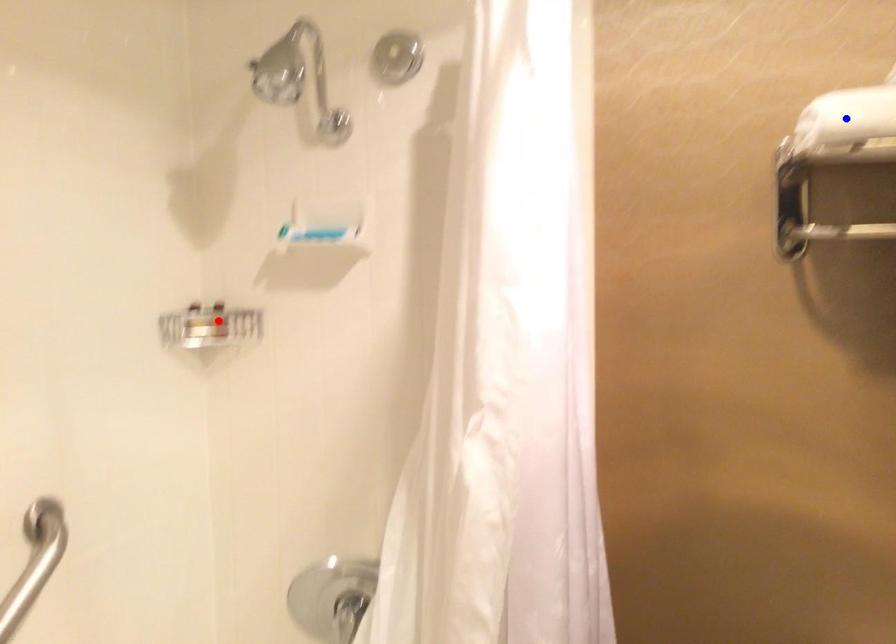
Question: Which of the two points in the image is closer to the camera?

Choices:
 (A) Blue point is closer.
 (B) Red point is closer.

Answer: (A)